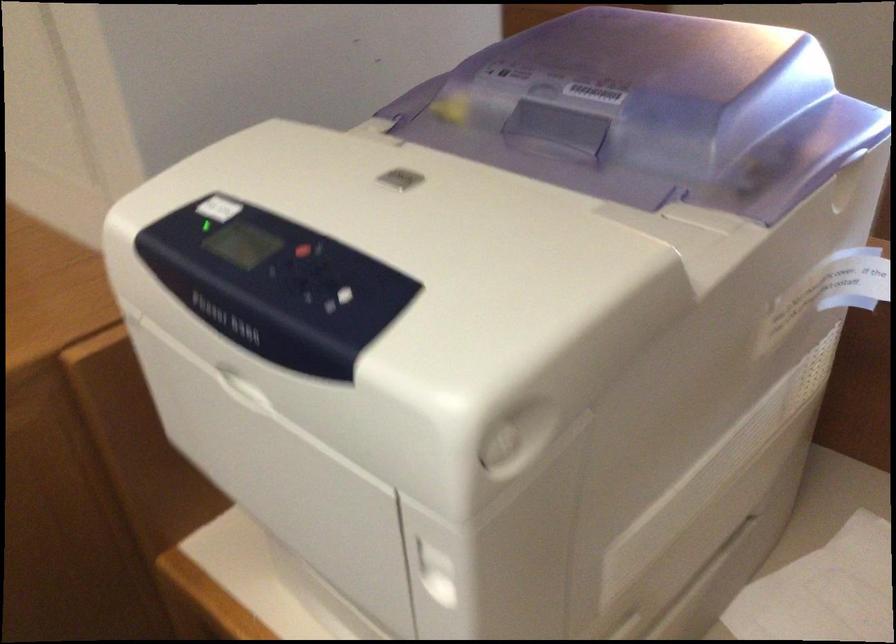
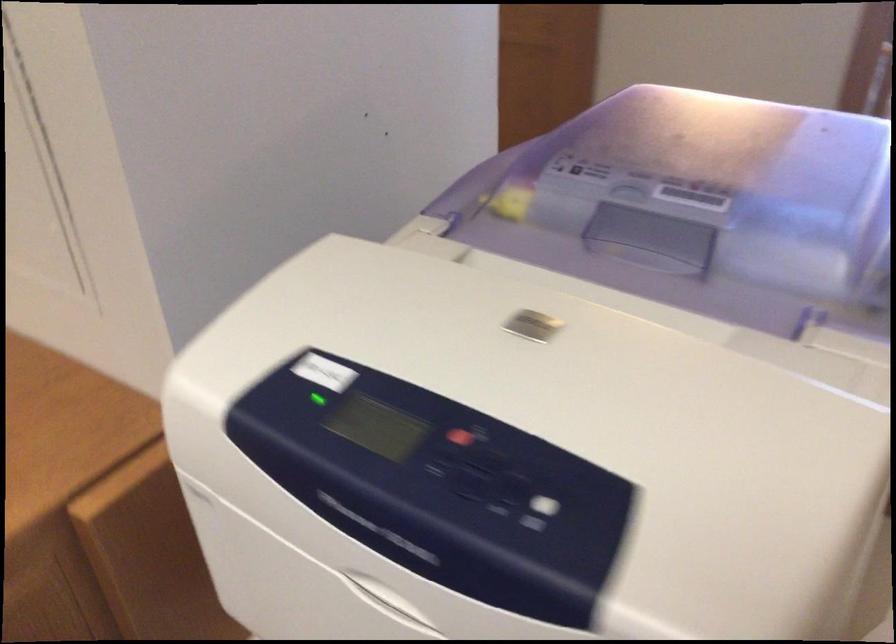
In the second image, find the point that corresponds to (x=571, y=128) in the first image.

(656, 234)